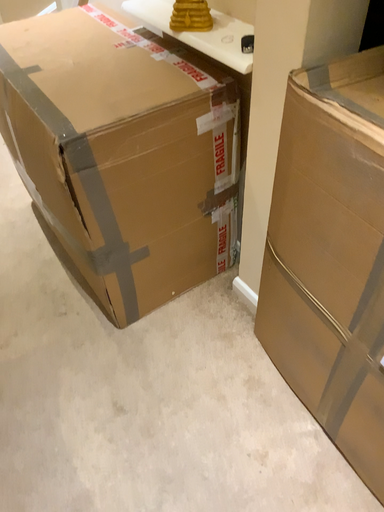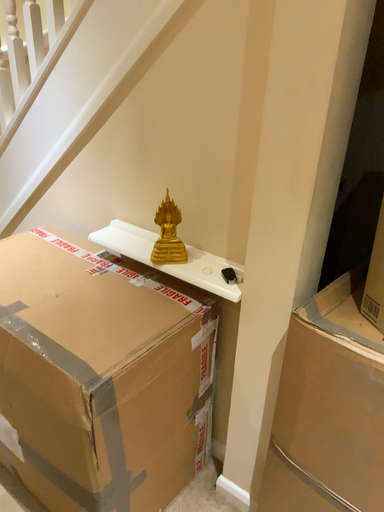
Question: Which way did the camera rotate in the video?

Choices:
 (A) rotated upward
 (B) rotated downward

Answer: (A)